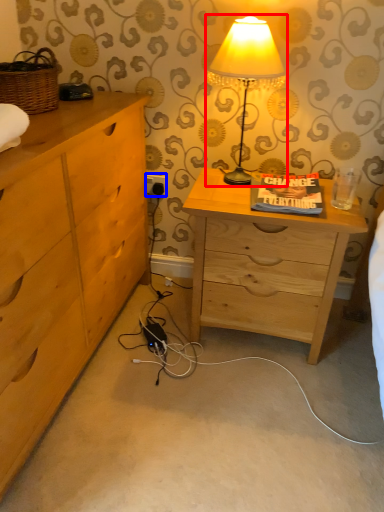
Question: Among these objects, which one is farthest to the camera, lamp (highlighted by a red box) or electric outlet (highlighted by a blue box)?

Choices:
 (A) lamp
 (B) electric outlet

Answer: (B)